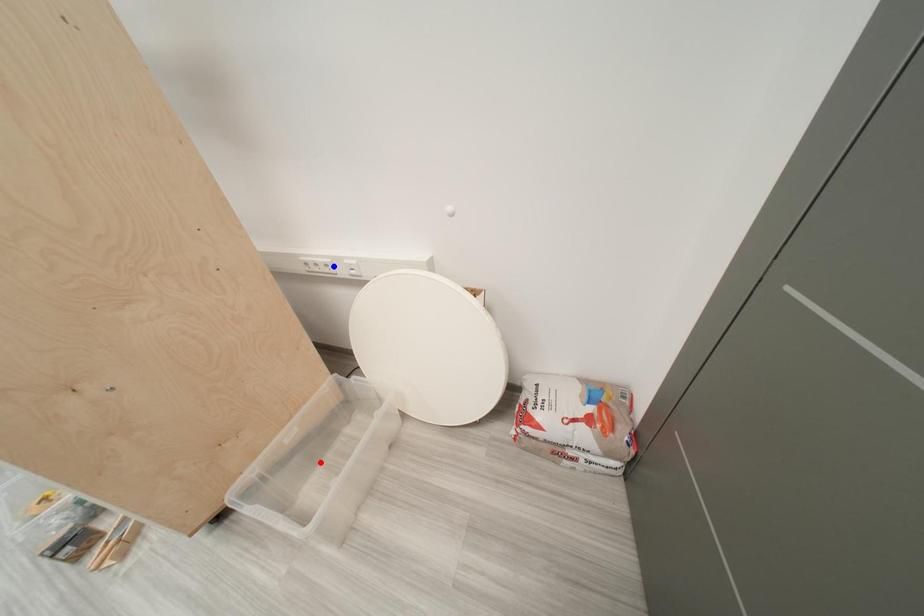
Question: Which of the two points in the image is closer to the camera?

Choices:
 (A) Blue point is closer.
 (B) Red point is closer.

Answer: (B)